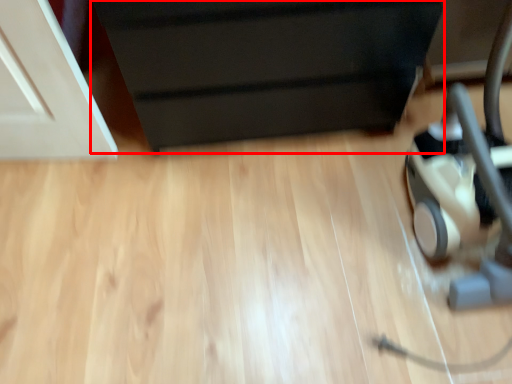
Question: From the image's perspective, what is the correct spatial relationship of furniture (annotated by the red box) in relation to baby carriage?

Choices:
 (A) below
 (B) above

Answer: (B)